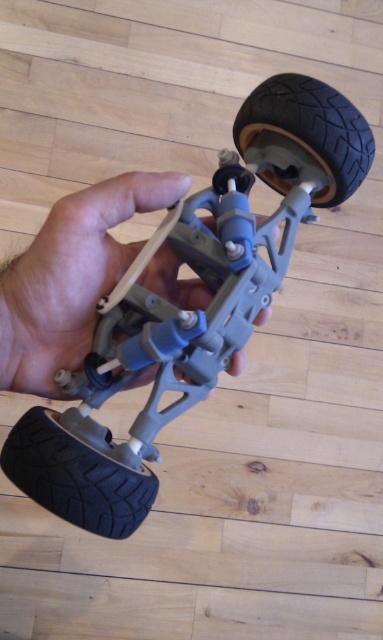
Question: In this image, where is matte gray plastic toy car at center located relative to black rubber wheel at lower left?

Choices:
 (A) left
 (B) right

Answer: (B)

Question: Which of these objects is positioned closest to the black rubber wheel at lower left?

Choices:
 (A) matte gray plastic toy car at center
 (B) black rubber tire at upper right

Answer: (A)

Question: Which is farther from the black rubber tire at upper right?

Choices:
 (A) matte gray plastic toy car at center
 (B) black rubber wheel at lower left

Answer: (B)

Question: Is matte gray plastic toy car at center above black rubber tire at upper right?

Choices:
 (A) no
 (B) yes

Answer: (A)

Question: Based on their relative distances, which object is nearer to the gray matte plastic hand at center?

Choices:
 (A) black rubber wheel at lower left
 (B) black rubber tire at upper right
 (C) matte gray plastic toy car at center

Answer: (C)

Question: Is black rubber wheel at lower left positioned in front of black rubber tire at upper right?

Choices:
 (A) no
 (B) yes

Answer: (B)